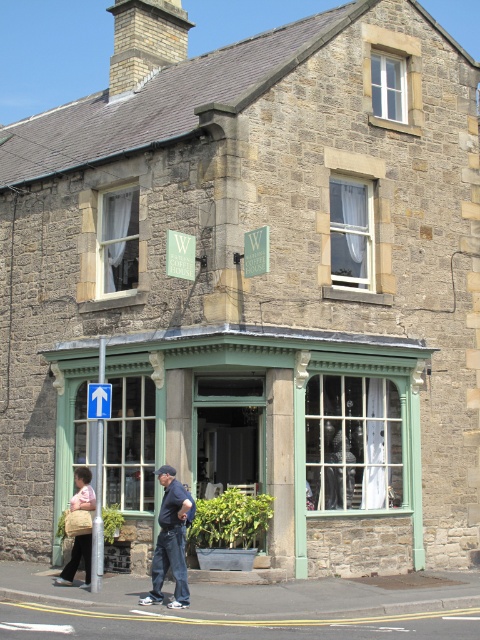
You are a customer entering the coffee house and see the dark blue jeans at lower center and the beige woven bag at lower left. Which item is larger in size?

The dark blue jeans at lower center is bigger than the beige woven bag at lower left.

You are a customer entering the coffee house and see both the matte beige handbag at lower left and the beige woven bag at lower left near the entrance. Which bag should you place your items into if you need a wider one?

The matte beige handbag at lower left might be wider than the beige woven bag at lower left, so you should choose the matte beige handbag at lower left.